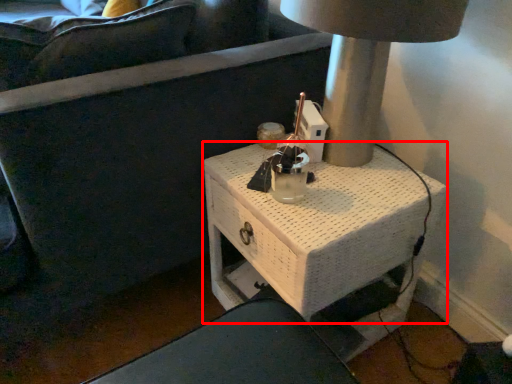
Question: Where is table (annotated by the red box) located in relation to table lamp in the image?

Choices:
 (A) right
 (B) left

Answer: (B)